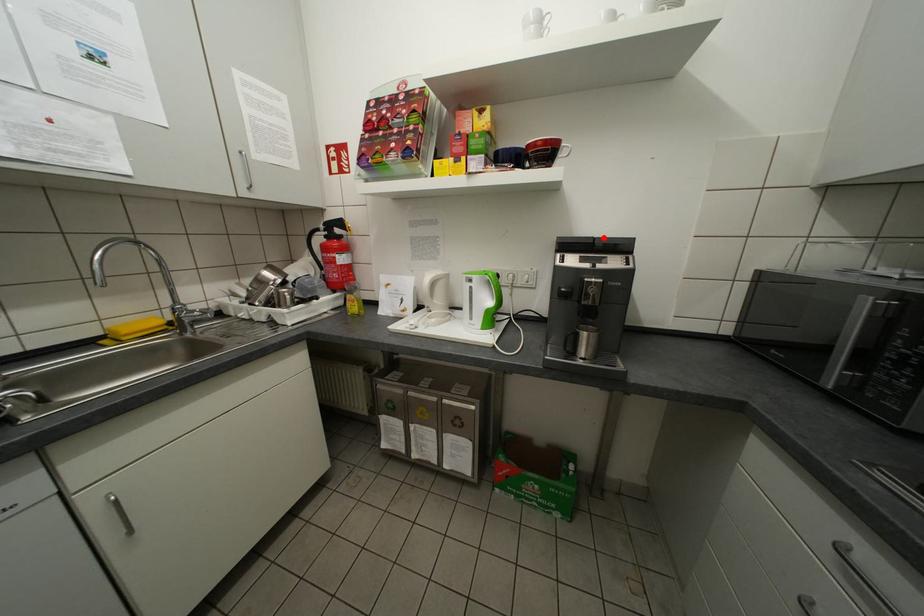
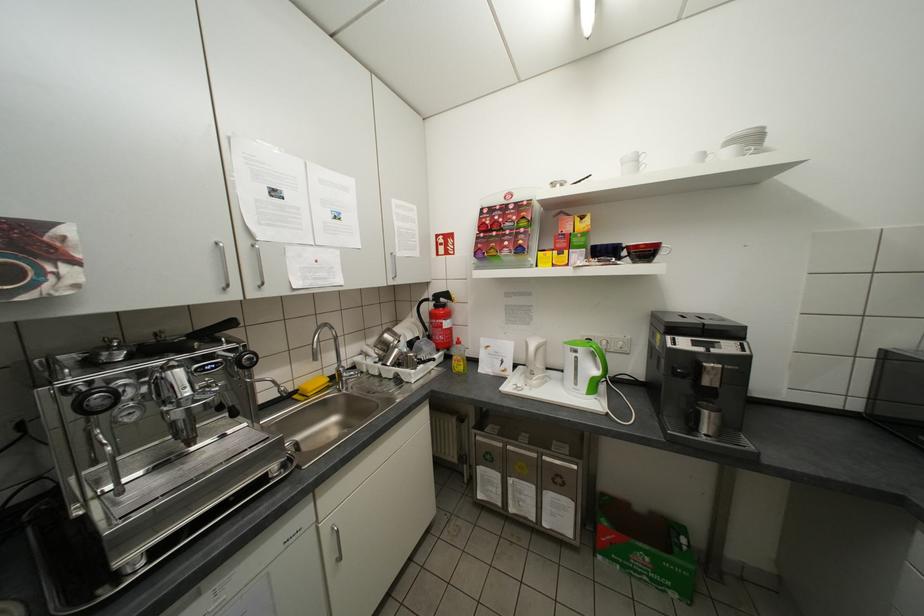
The point at the highlighted location is marked in the first image. Where is the corresponding point in the second image?

(712, 323)